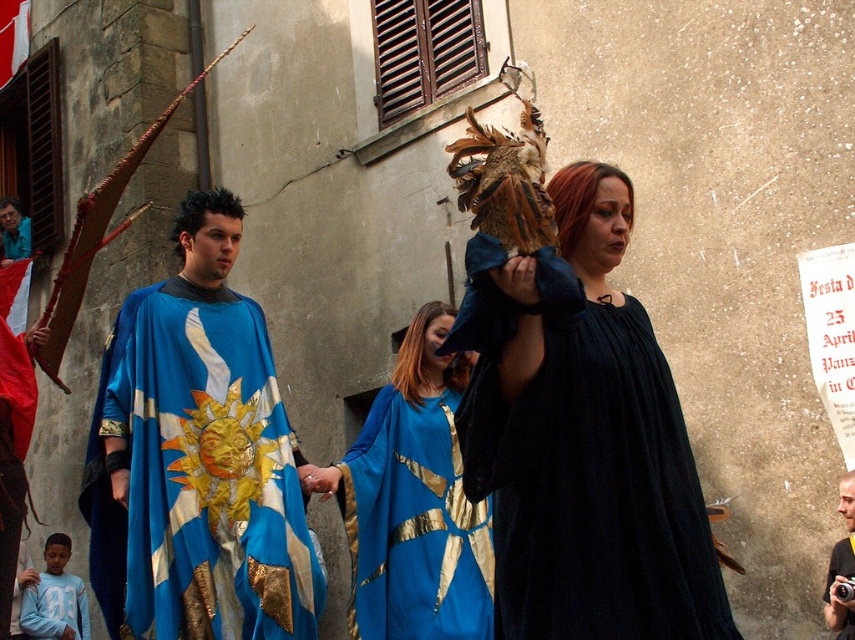
Does light blue cotton shirt at lower left appear on the right side of smooth silver camera at center?

Incorrect, light blue cotton shirt at lower left is not on the right side of smooth silver camera at center.

Can you confirm if light blue cotton shirt at lower left is positioned below smooth silver camera at center?

Correct, light blue cotton shirt at lower left is located below smooth silver camera at center.

Which is in front, point (77, 604) or point (845, 625)?

Point (845, 625) is more forward.

What are the coordinates of `light blue cotton shirt at lower left` in the screenshot? It's located at (55, 596).

Between blue silk cape at center and shiny blue cape at center, which one has less height?

shiny blue cape at center

Does point (133, 376) come behind point (18, 218)?

That is False.

Between point (219, 602) and point (16, 212), which one is positioned behind?

Point (16, 212)

Find the location of a particular element. Image resolution: width=855 pixels, height=640 pixels. blue silk cape at center is located at coordinates (204, 451).

Can you confirm if velvet dark blue dress at center is thinner than blue satin cape at center?

In fact, velvet dark blue dress at center might be wider than blue satin cape at center.

Can you confirm if velvet dark blue dress at center is smaller than blue satin cape at center?

No, velvet dark blue dress at center is not smaller than blue satin cape at center.

What do you see at coordinates (588, 451) in the screenshot?
I see `velvet dark blue dress at center` at bounding box center [588, 451].

The image size is (855, 640). Find the location of `velvet dark blue dress at center`. velvet dark blue dress at center is located at coordinates (588, 451).